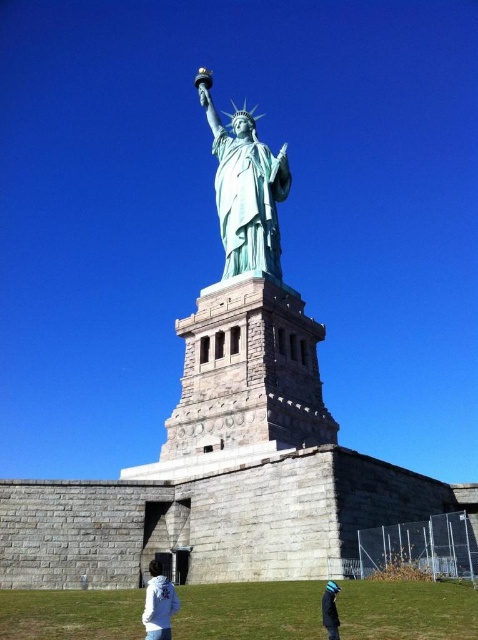
You are a tourist visiting the Statue of Liberty. You notice the green patina statue at center and the white fleece jacket at lower center. Which object is positioned higher in the image?

The green patina statue at center is above the white fleece jacket at lower center, so it is positioned higher in the image.

You are a photographer standing at the base of the Statue of Liberty. You want to take a photo that includes both the white fleece jacket at lower center and the blue knit cap at lower center. However, you notice that one object is blocking the view of the other. Which object is blocking the view of the other?

The blue knit cap at lower center is behind the white fleece jacket at lower center, so the white fleece jacket at lower center is blocking the view of the blue knit cap at lower center.